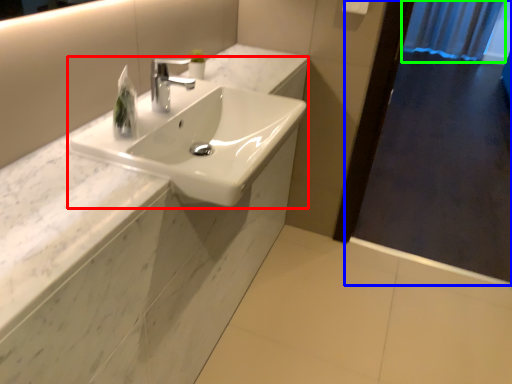
Question: Which object is positioned closest to sink (highlighted by a red box)? Select from screen door (highlighted by a blue box) and shower curtain (highlighted by a green box).

Choices:
 (A) screen door
 (B) shower curtain

Answer: (A)